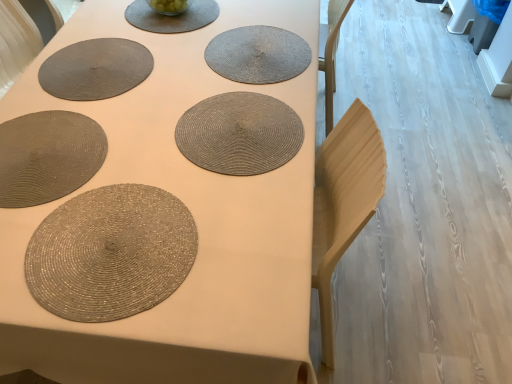
Image resolution: width=512 pixels, height=384 pixels. Identify the location of free space to the left of rattan placemat at center, the first coaster ordered from the bottom. (119, 134).